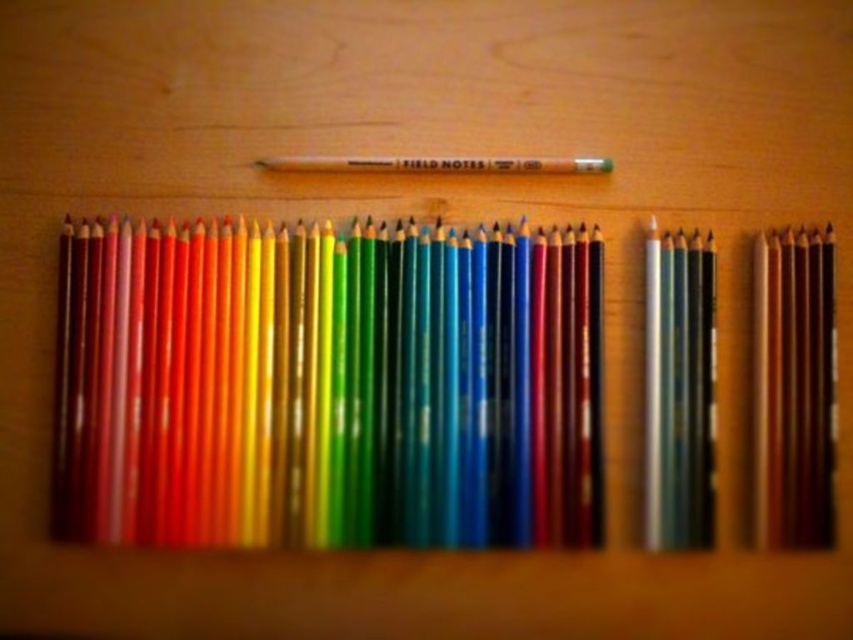
Can you confirm if matte wooden pencils at center is thinner than metallic gray pencils at right?

No.

Identify the location of matte wooden pencils at center. This screenshot has width=853, height=640. (328, 385).